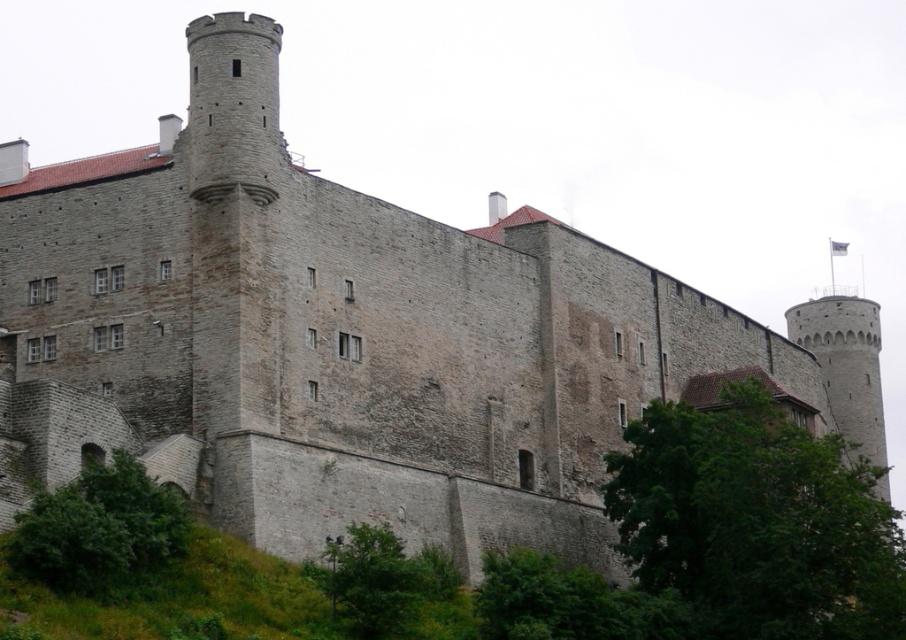
Question: Which point is closer to the camera?

Choices:
 (A) (662, 520)
 (B) (68, 556)
 (C) (393, 536)

Answer: (B)

Question: Can you confirm if green leafy tree at lower right is positioned to the right of green leafy bush at lower left?

Choices:
 (A) no
 (B) yes

Answer: (B)

Question: Is green leafy tree at lower right positioned before green leafy tree at lower center?

Choices:
 (A) no
 (B) yes

Answer: (A)

Question: Which object is closer to the camera taking this photo?

Choices:
 (A) green leafy bush at lower left
 (B) green leafy tree at lower right
 (C) green leafy tree at lower center

Answer: (A)

Question: Which point is farther to the camera?

Choices:
 (A) green leafy bush at lower left
 (B) green leafy tree at lower right

Answer: (B)

Question: Where is green leafy tree at lower right located in relation to green leafy bush at lower left in the image?

Choices:
 (A) below
 (B) above

Answer: (A)